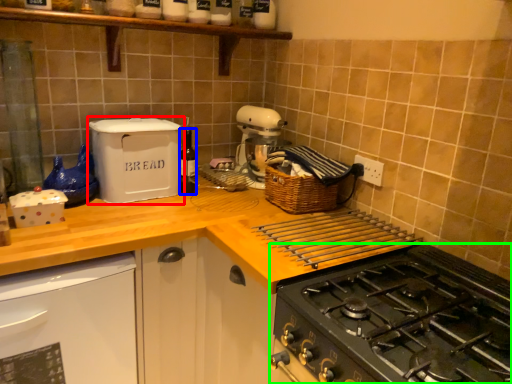
Question: Considering the real-world distances, which object is closest to kitchen appliance (highlighted by a red box)? bottle (highlighted by a blue box) or gas stove (highlighted by a green box).

Choices:
 (A) bottle
 (B) gas stove

Answer: (A)